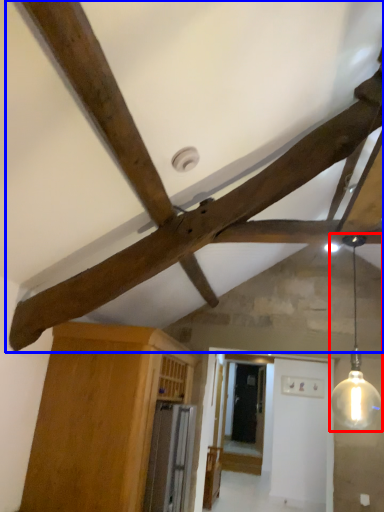
Question: Which of the following is the farthest to the observer, light fixture (highlighted by a red box) or fan (highlighted by a blue box)?

Choices:
 (A) light fixture
 (B) fan

Answer: (B)